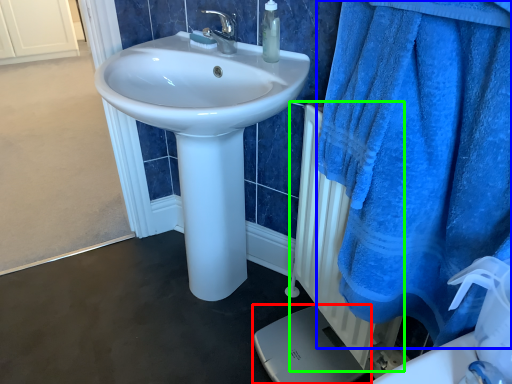
Question: Estimate the real-world distances between objects in this image. Which object is farther from porcelain (highlighted by a red box), bath towel (highlighted by a blue box) or radiator (highlighted by a green box)?

Choices:
 (A) bath towel
 (B) radiator

Answer: (A)